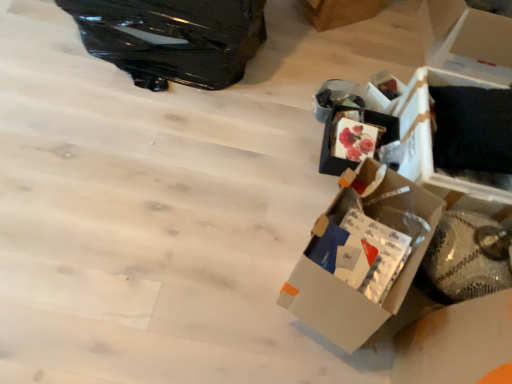
Where is `free space to the left of white cardboard box at center-right`? free space to the left of white cardboard box at center-right is located at coordinates (231, 248).